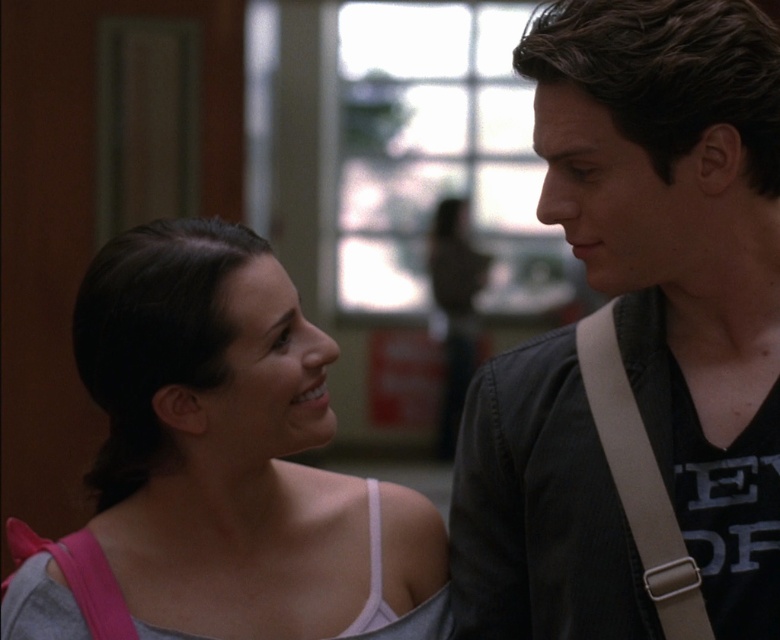
Can you confirm if matte gray tank top at center is wider than tan fabric strap at right?

Yes, matte gray tank top at center is wider than tan fabric strap at right.

Does matte gray tank top at center have a larger size compared to tan fabric strap at right?

Yes, matte gray tank top at center is bigger than tan fabric strap at right.

The width and height of the screenshot is (780, 640). In order to click on matte gray tank top at center in this screenshot , I will do `click(220, 465)`.

Where is `matte gray tank top at center`? This screenshot has width=780, height=640. matte gray tank top at center is located at coordinates (220, 465).

Is dark brown hair at upper right above tan fabric strap at right?

Yes, dark brown hair at upper right is above tan fabric strap at right.

Is dark brown hair at upper right further to the viewer compared to tan fabric strap at right?

No.

The height and width of the screenshot is (640, 780). In order to click on dark brown hair at upper right in this screenshot , I will do `click(637, 340)`.

Who is taller, dark brown hair at upper right or matte gray tank top at center?

dark brown hair at upper right

Identify the location of dark brown hair at upper right. This screenshot has height=640, width=780. (x=637, y=340).

At what (x,y) coordinates should I click in order to perform the action: click on dark brown hair at upper right. Please return your answer as a coordinate pair (x, y). Looking at the image, I should click on (637, 340).